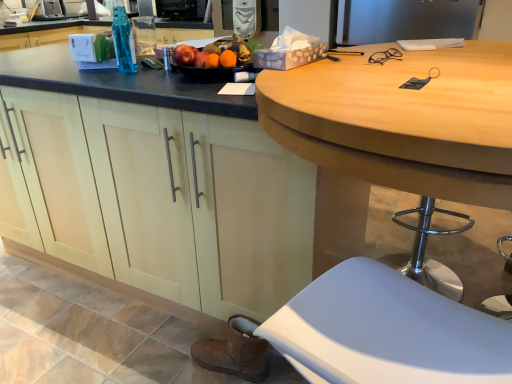
Question: Does wooden desk at center have a lesser height compared to brushed metal sink at upper left?

Choices:
 (A) yes
 (B) no

Answer: (B)

Question: Considering the relative positions of wooden desk at center and brushed metal sink at upper left in the image provided, is wooden desk at center in front of brushed metal sink at upper left?

Choices:
 (A) no
 (B) yes

Answer: (B)

Question: Can you confirm if wooden desk at center is smaller than brushed metal sink at upper left?

Choices:
 (A) yes
 (B) no

Answer: (B)

Question: From a real-world perspective, is wooden desk at center physically below brushed metal sink at upper left?

Choices:
 (A) no
 (B) yes

Answer: (B)

Question: Is wooden desk at center taller than brushed metal sink at upper left?

Choices:
 (A) no
 (B) yes

Answer: (B)

Question: Does point (53, 16) appear closer or farther from the camera than point (377, 57)?

Choices:
 (A) closer
 (B) farther

Answer: (B)

Question: Considering the relative positions of brushed metal sink at upper left and clear plastic glasses at upper right in the image provided, is brushed metal sink at upper left to the left or to the right of clear plastic glasses at upper right?

Choices:
 (A) left
 (B) right

Answer: (A)

Question: From the image's perspective, is brushed metal sink at upper left positioned above or below clear plastic glasses at upper right?

Choices:
 (A) above
 (B) below

Answer: (A)

Question: Which is correct: brushed metal sink at upper left is inside clear plastic glasses at upper right, or outside of it?

Choices:
 (A) outside
 (B) inside

Answer: (A)

Question: Relative to brown suede boot at lower left, is white plastic stool at lower right in front or behind?

Choices:
 (A) front
 (B) behind

Answer: (A)

Question: Is white plastic stool at lower right inside or outside of brown suede boot at lower left?

Choices:
 (A) outside
 (B) inside

Answer: (A)

Question: Is point (382, 367) positioned closer to the camera than point (253, 375)?

Choices:
 (A) closer
 (B) farther

Answer: (A)

Question: From the image's perspective, is white plastic stool at lower right above or below brown suede boot at lower left?

Choices:
 (A) above
 (B) below

Answer: (A)

Question: In terms of width, does brown suede boot at lower left look wider or thinner when compared to white plastic stool at lower right?

Choices:
 (A) wide
 (B) thin

Answer: (B)

Question: From the image's perspective, is brown suede boot at lower left positioned above or below white plastic stool at lower right?

Choices:
 (A) below
 (B) above

Answer: (A)